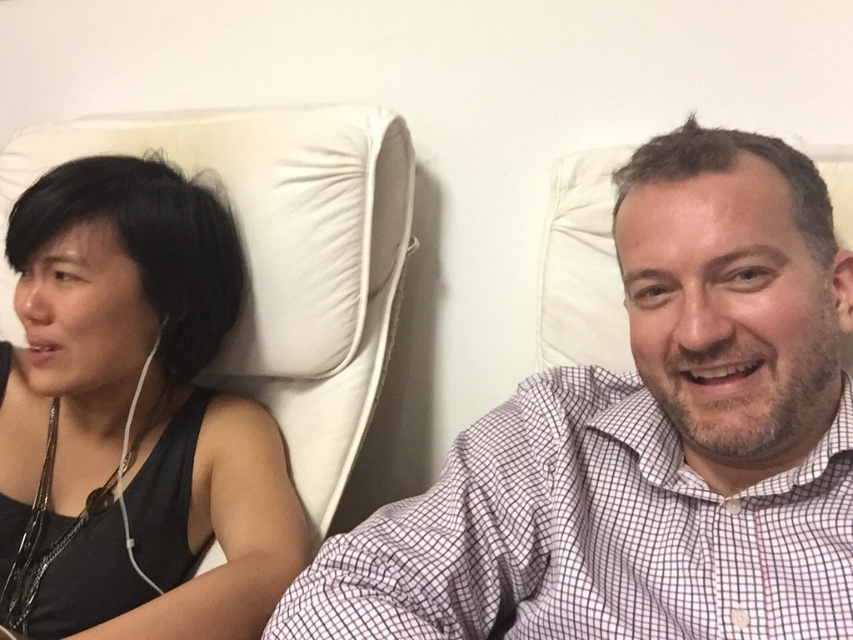
You are a fashion designer who wants to create a new line of layered outfits. You see the white checkered shirt at center and the black fabric tank top at left in the image. Which one should be placed under the other to ensure proper layering without any visible mismatch?

The white checkered shirt at center is shorter than the black fabric tank top at left, so the black fabric tank top at left should be worn under the white checkered shirt at center to avoid the tank top peeking out from underneath.

You are designing a new clothing line and want to ensure that the white checkered shirt at center and the black fabric tank top at left will look balanced when displayed side by side. Based on their widths, which one should be placed on the left to create a visually appealing arrangement?

The white checkered shirt at center is wider than the black fabric tank top at left. To create a visually appealing arrangement, place the wider white checkered shirt at center on the left side so it transitions smoothly to the narrower black fabric tank top at left on the right, creating a balanced look.

You are a photographer taking a portrait of two people sitting on a couch. You notice the white checkered shirt at center and the black fabric tank top at left. Which clothing item is positioned lower in the image?

The white checkered shirt at center is located below the black fabric tank top at left, so it is positioned lower in the image.